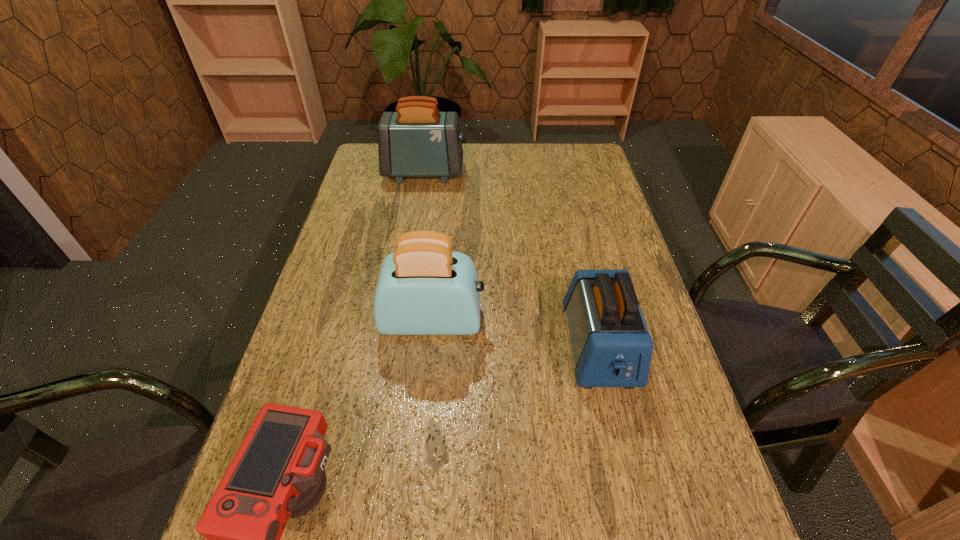
The width and height of the screenshot is (960, 540). What are the coordinates of `vacant space at the left edge of the desktop` in the screenshot? It's located at (389, 212).

The height and width of the screenshot is (540, 960). I want to click on free space at the right edge, so click(x=660, y=354).

I want to click on free space between the third tallest object and the farthest object, so click(512, 260).

Where is `vacant space in between the farthest toaster and the rightmost object`? Image resolution: width=960 pixels, height=540 pixels. vacant space in between the farthest toaster and the rightmost object is located at coordinates (512, 260).

Locate an element on the screen. free point between the farthest toaster and the rightmost toaster is located at coordinates (512, 260).

You are a GUI agent. You are given a task and a screenshot of the screen. Output one action in this format:
    pyautogui.click(x=<x>, y=<y>)
    Task: Click on the vacant space that's between the third tallest object and the farthest object
    
    Given the screenshot: What is the action you would take?
    pyautogui.click(x=512, y=260)

Choose which object is the nearest neighbor to the shortest object. Please provide its 2D coordinates. Your answer should be formatted as a tuple, i.e. [(x, y)], where the tuple contains the x and y coordinates of a point satisfying the conditions above.

[(424, 288)]

Locate which object ranks in proximity to the rightmost toaster. Please provide its 2D coordinates. Your answer should be formatted as a tuple, i.e. [(x, y)], where the tuple contains the x and y coordinates of a point satisfying the conditions above.

[(424, 288)]

The image size is (960, 540). I want to click on the closest toaster relative to the rightmost toaster, so click(x=424, y=288).

Identify which toaster is located as the second nearest to the shortest object. Please provide its 2D coordinates. Your answer should be formatted as a tuple, i.e. [(x, y)], where the tuple contains the x and y coordinates of a point satisfying the conditions above.

[(611, 346)]